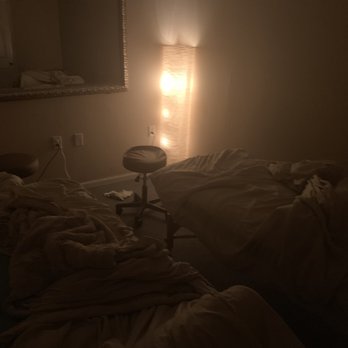
You are a GUI agent. You are given a task and a screenshot of the screen. Output one action in this format:
    pyautogui.click(x=<x>, y=<y>)
    Task: Click on the mirror
    This screenshot has width=348, height=348.
    Given the screenshot: What is the action you would take?
    pyautogui.click(x=51, y=72)